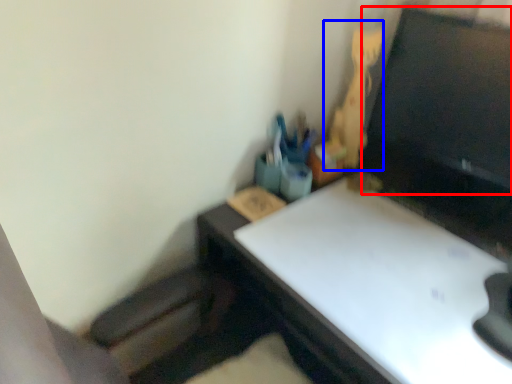
Question: Which object appears closest to the camera in this image, computer monitor (highlighted by a red box) or toy (highlighted by a blue box)?

Choices:
 (A) computer monitor
 (B) toy

Answer: (A)